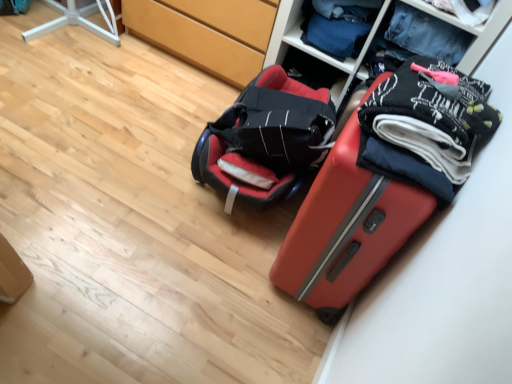
Question: Is matte red suitcase at lower right wider or thinner than textured fabric clothes at upper right?

Choices:
 (A) wide
 (B) thin

Answer: (B)

Question: From their relative heights in the image, would you say matte red suitcase at lower right is taller or shorter than textured fabric clothes at upper right?

Choices:
 (A) tall
 (B) short

Answer: (B)

Question: Which of these objects is positioned farthest from the matte red suitcase at lower right?

Choices:
 (A) matte black bag at center
 (B) denim jeans at upper right, placed as the 1th clothing when sorted from back to front
 (C) black cotton socks at upper right, the first clothing from the front
 (D) matte wood cabinet at center
 (E) textured fabric clothes at upper right

Answer: (D)

Question: Which is nearer to the matte red suitcase at lower right?

Choices:
 (A) textured fabric clothes at upper right
 (B) black cotton socks at upper right, the first clothing from the front
 (C) matte wood cabinet at center
 (D) denim jeans at upper right, which ranks as the second clothing in bottom-to-top order
 (E) matte black bag at center

Answer: (B)